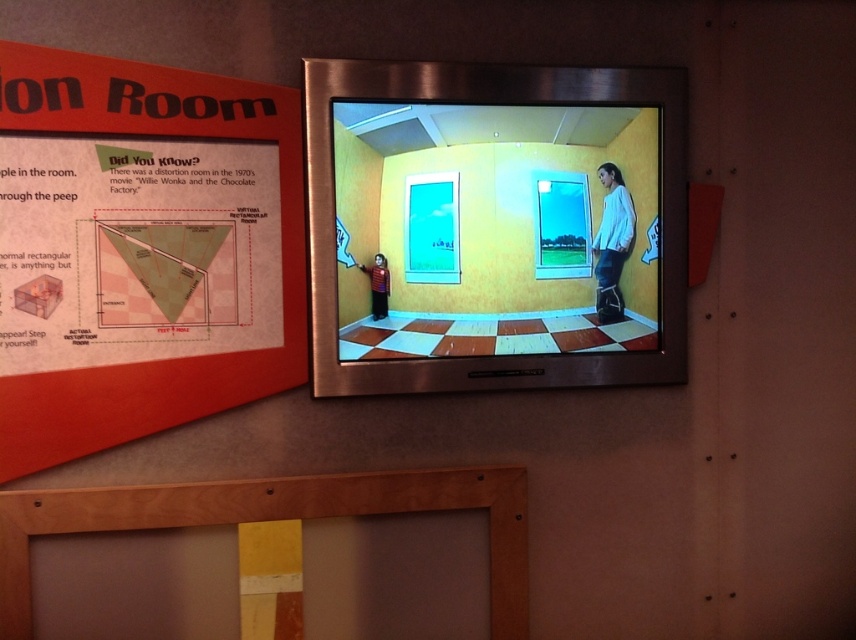
You are a visitor at the exhibit and want to take a photo of the wooden frame at lower center and the matte red sweater at center. Which object should you focus on first if you want to capture both in a single frame without zooming in or out?

The wooden frame at lower center is bigger than the matte red sweater at center, so you should focus on the wooden frame at lower center first to ensure it fits properly in the frame.

What is the position of the matte orange poster at upper left relative to the wooden frame at lower center?

The matte orange poster at upper left is to the left of the wooden frame at lower center.